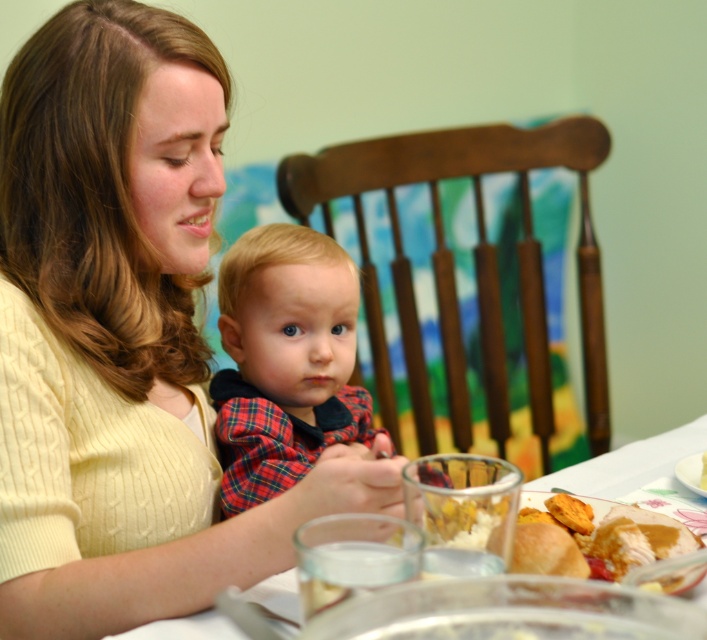
Between matte yellow sweater at center and white creamy bread at center, which one has less height?

With less height is white creamy bread at center.

Between matte yellow sweater at center and white creamy bread at center, which one is positioned lower?

white creamy bread at center

At what (x,y) coordinates should I click in order to perform the action: click on matte yellow sweater at center. Please return your answer as a coordinate pair (x, y). This screenshot has height=640, width=707. Looking at the image, I should click on (122, 337).

Does point (151, 465) lie in front of point (679, 582)?

No, (151, 465) is further to viewer.

Is matte yellow sweater at center above golden brown bread at lower right?

Yes, matte yellow sweater at center is above golden brown bread at lower right.

Where is `matte yellow sweater at center`? This screenshot has width=707, height=640. matte yellow sweater at center is located at coordinates click(x=122, y=337).

Between clear glass plate at center and white creamy bread at center, which one appears on the right side from the viewer's perspective?

white creamy bread at center

This screenshot has width=707, height=640. In order to click on clear glass plate at center in this screenshot , I will do coord(629,464).